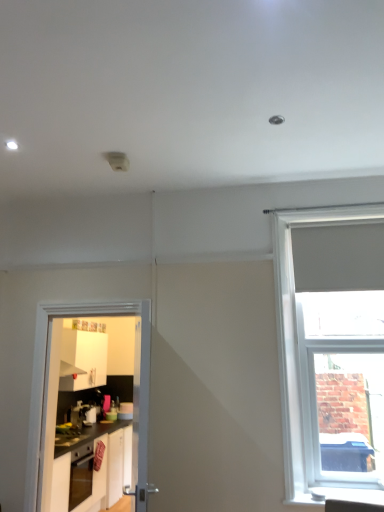
I want to click on empty space that is ontop of white glossy door at left (from a real-world perspective), so click(77, 295).